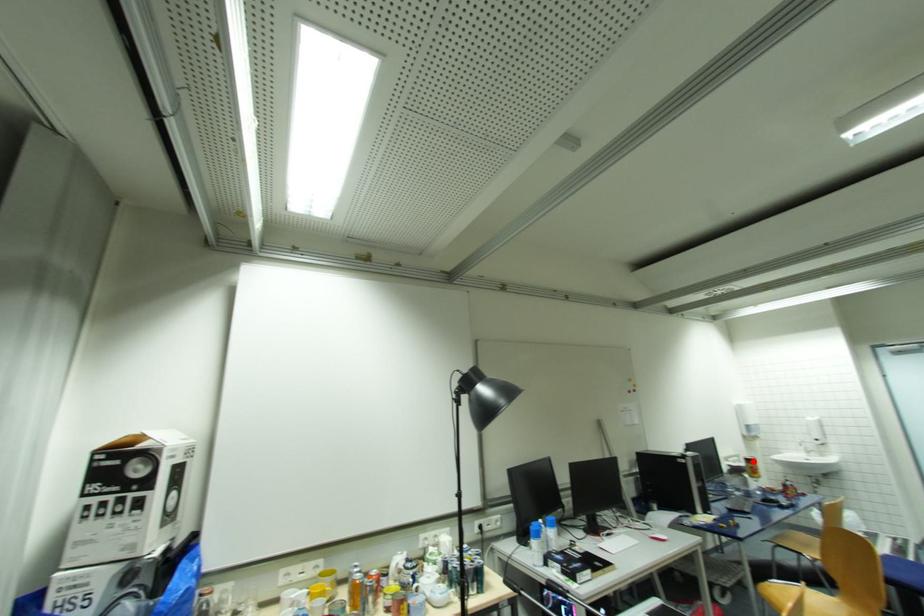
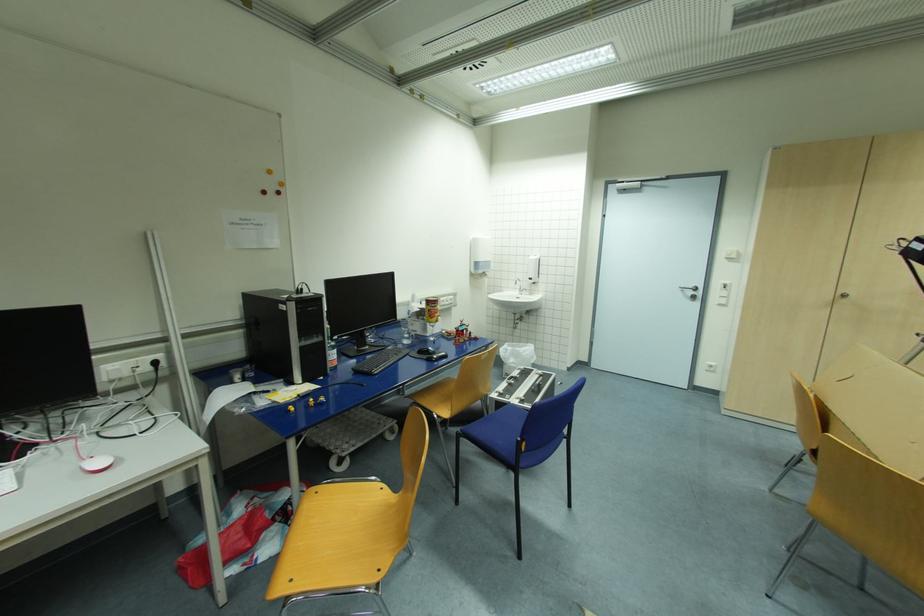
Where in the second image is the point corresponding to the highlighted location from the first image?

(433, 302)